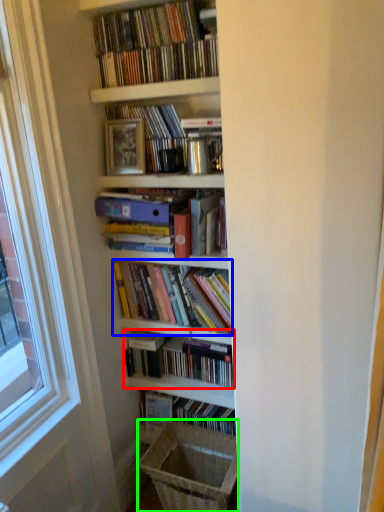
Question: Which is nearer to the book (highlighted by a red box)? book (highlighted by a blue box) or laundry basket (highlighted by a green box).

Choices:
 (A) book
 (B) laundry basket

Answer: (A)